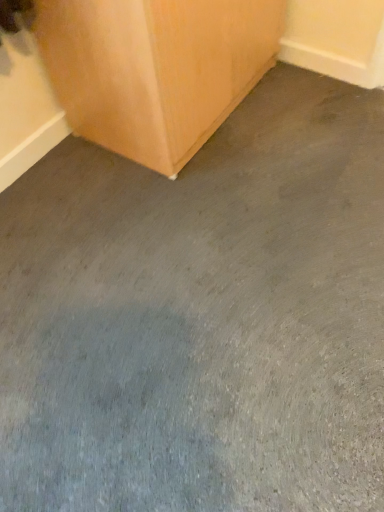
What do you see at coordinates (155, 69) in the screenshot? I see `light brown wood cabinet at upper left` at bounding box center [155, 69].

What is the approximate width of light brown wood cabinet at upper left?

It is 22.03 inches.

Identify the location of light brown wood cabinet at upper left. (155, 69).

This screenshot has width=384, height=512. In order to click on light brown wood cabinet at upper left in this screenshot , I will do `click(155, 69)`.